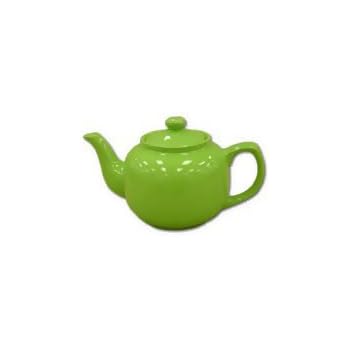
The width and height of the screenshot is (350, 350). Find the location of `pitcher`. pitcher is located at coordinates (213, 185).